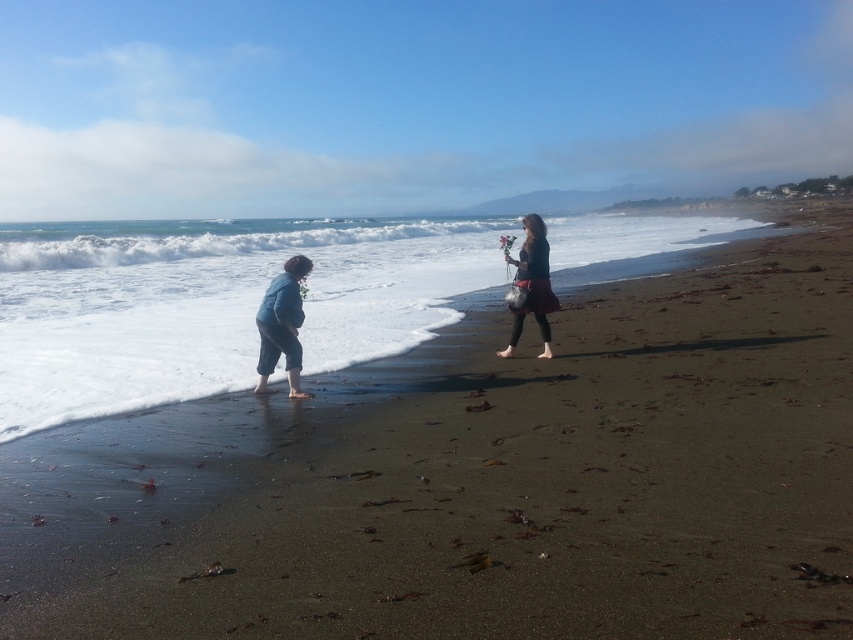
Locate an element on the screen. denim pants at left is located at coordinates (282, 324).

Is denim pants at left wider than dark blue fabric dress at center right?

No, denim pants at left is not wider than dark blue fabric dress at center right.

This screenshot has width=853, height=640. Identify the location of denim pants at left. (282, 324).

Does dark brown sand at lower left have a smaller size compared to denim pants at left?

No, dark brown sand at lower left is not smaller than denim pants at left.

How distant is dark brown sand at lower left from denim pants at left?

A distance of 18.56 feet exists between dark brown sand at lower left and denim pants at left.

Is point (466, 547) farther from camera compared to point (305, 272)?

No, it is not.

The width and height of the screenshot is (853, 640). I want to click on dark brown sand at lower left, so click(x=549, y=483).

From the picture: Between dark brown sand at lower left and dark blue fabric dress at center right, which one appears on the right side from the viewer's perspective?

Positioned to the right is dark brown sand at lower left.

Is dark brown sand at lower left bigger than dark blue fabric dress at center right?

Yes, dark brown sand at lower left is bigger than dark blue fabric dress at center right.

You are a GUI agent. You are given a task and a screenshot of the screen. Output one action in this format:
    pyautogui.click(x=<x>, y=<y>)
    Task: Click on the dark brown sand at lower left
    The width and height of the screenshot is (853, 640).
    Given the screenshot: What is the action you would take?
    pyautogui.click(x=549, y=483)

What are the coordinates of `dark brown sand at lower left` in the screenshot? It's located at (549, 483).